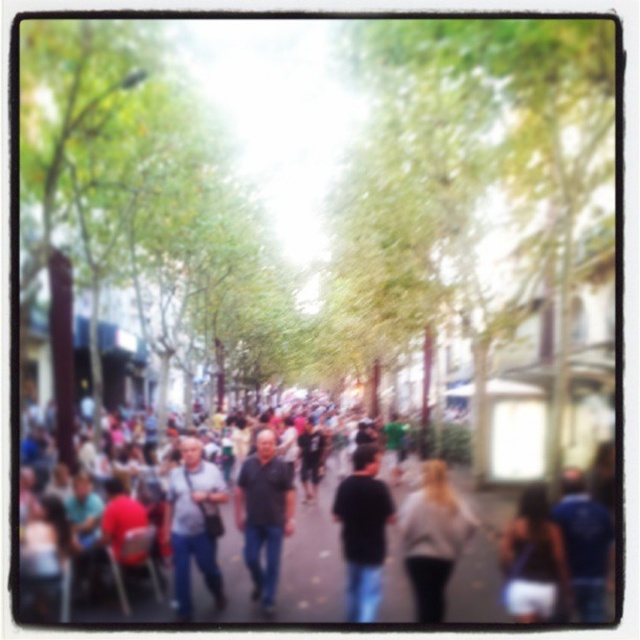
Does green leafy tree at center have a larger size compared to dark gray shirt at center?

Correct, green leafy tree at center is larger in size than dark gray shirt at center.

Can you confirm if green leafy tree at center is wider than dark gray shirt at center?

Correct, the width of green leafy tree at center exceeds that of dark gray shirt at center.

Between point (570, 128) and point (252, 472), which one is positioned in front?

Point (570, 128)

I want to click on green leafy tree at center, so click(483, 221).

Can you confirm if dark gray shirt at center is thinner than blue fabric shirt at center?

In fact, dark gray shirt at center might be wider than blue fabric shirt at center.

You are a GUI agent. You are given a task and a screenshot of the screen. Output one action in this format:
    pyautogui.click(x=<x>, y=<y>)
    Task: Click on the dark gray shirt at center
    The height and width of the screenshot is (640, 640).
    Given the screenshot: What is the action you would take?
    pyautogui.click(x=262, y=515)

Find the location of a particular element. This screenshot has height=640, width=640. dark gray shirt at center is located at coordinates (262, 515).

Can you confirm if dark brown leather bag at lower right is shorter than black matte shirt at center?

Indeed, dark brown leather bag at lower right has a lesser height compared to black matte shirt at center.

Identify the location of dark brown leather bag at lower right. (534, 563).